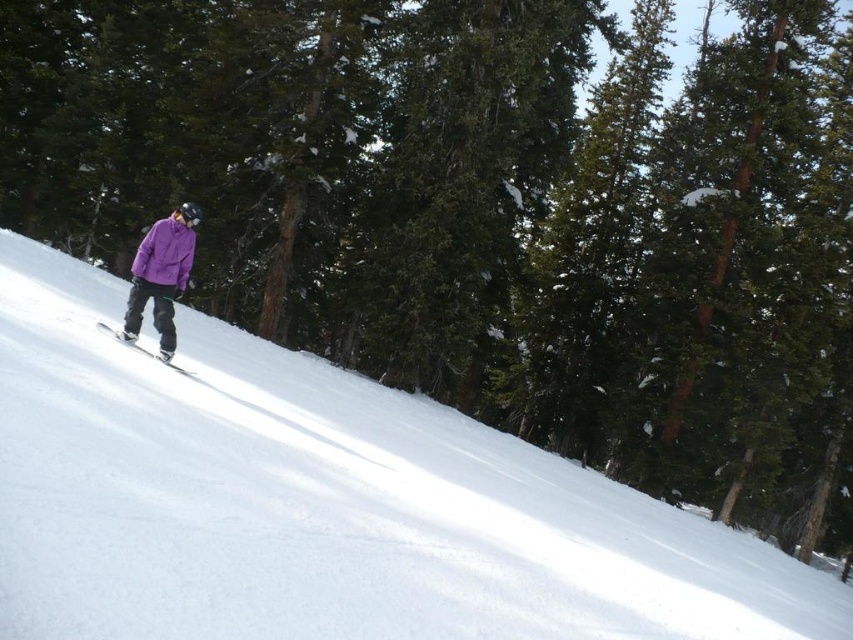
Question: Does white snow at center appear under purple matte jacket at left?

Choices:
 (A) yes
 (B) no

Answer: (A)

Question: Which object is closer to the camera taking this photo?

Choices:
 (A) white snow at center
 (B) purple matte jacket at left
 (C) purple fleece jacket at center

Answer: (A)

Question: Can you confirm if white snow at center is wider than purple fleece jacket at center?

Choices:
 (A) yes
 (B) no

Answer: (A)

Question: Is white snow at center behind purple matte jacket at left?

Choices:
 (A) yes
 (B) no

Answer: (B)

Question: Which point is farther to the camera?

Choices:
 (A) white metallic ski at center
 (B) white snow at center

Answer: (A)

Question: Which point is closer to the camera?

Choices:
 (A) (189, 252)
 (B) (160, 236)
 (C) (62, 280)

Answer: (B)